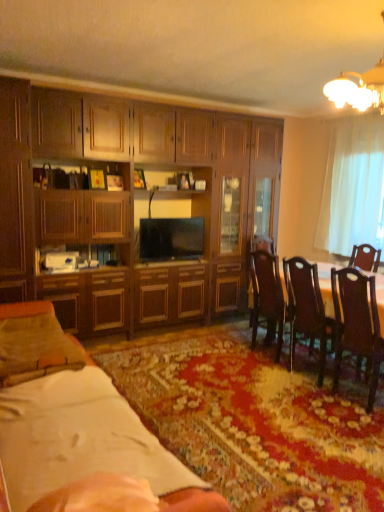
In order to click on white paper at lower left in this screenshot , I will do `click(79, 434)`.

Identify the location of suede-like beige pillow at lower left. (34, 343).

Between point (22, 201) and point (325, 289), which one is positioned in front?

The point (325, 289) is in front.

Image resolution: width=384 pixels, height=512 pixels. I want to click on round table on the right of matte wood cabinet at left, the 2th cabinetry viewed from the right, so click(326, 286).

Which object is positioned more to the right, matte wood cabinet at left, the 2th cabinetry viewed from the right, or brown wooden table at right?

Positioned to the right is brown wooden table at right.

Based on the photo, would you say matte wood cabinet at left, positioned as the first cabinetry in left-to-right order, is outside brown wooden table at right?

Yes, matte wood cabinet at left, positioned as the first cabinetry in left-to-right order, is not within brown wooden table at right.

From a real-world perspective, is white paper at lower left located higher than suede-like beige pillow at lower left?

No, from a real-world perspective, white paper at lower left is not on top of suede-like beige pillow at lower left.

Does point (99, 458) come farther from viewer compared to point (25, 356)?

No, (99, 458) is in front of (25, 356).

Considering the sizes of objects white paper at lower left and suede-like beige pillow at lower left in the image provided, who is shorter, white paper at lower left or suede-like beige pillow at lower left?

With less height is white paper at lower left.

From the image's perspective, between white paper at lower left and suede-like beige pillow at lower left, who is located below?

white paper at lower left.

Considering the relative sizes of brown wooden table at right and dark wood chair at right, which is counted as the 1th chair, starting from the right, in the image provided, is brown wooden table at right wider than dark wood chair at right, which is counted as the 1th chair, starting from the right,?

Indeed, brown wooden table at right has a greater width compared to dark wood chair at right, which is counted as the 1th chair, starting from the right.

Based on their positions, is brown wooden table at right located to the left or right of dark wood chair at right, acting as the 2th chair starting from the left?

From the image, it's evident that brown wooden table at right is to the right of dark wood chair at right, acting as the 2th chair starting from the left.

From the image's perspective, would you say brown wooden table at right is shown under dark wood chair at right, which is counted as the 1th chair, starting from the right?

No, from the image's perspective, brown wooden table at right is not beneath dark wood chair at right, which is counted as the 1th chair, starting from the right.

From the image's perspective, which is above, matte black tv at center or brown wooden table at right?

matte black tv at center.

Is matte black tv at center oriented away from brown wooden table at right?

No.

Which of these two, matte black tv at center or brown wooden table at right, is thinner?

Thinner between the two is matte black tv at center.

How different are the orientations of matte black tv at center and brown wooden table at right in degrees?

The facing directions of matte black tv at center and brown wooden table at right are 86.6 degrees apart.

Is white sheer curtain at right far from white paper at lower left?

Yes, white sheer curtain at right and white paper at lower left are quite far apart.

From a real-world perspective, does white sheer curtain at right stand above white paper at lower left?

Yes.

How much distance is there between white sheer curtain at right and white paper at lower left?

The distance of white sheer curtain at right from white paper at lower left is 3.57 meters.

Measure the distance between brown wooden table at right and white paper at lower left.

They are 6.53 feet apart.

Which object is closer to the camera taking this photo, brown wooden table at right or white paper at lower left?

white paper at lower left is closer to the camera.

Which is in front, point (381, 320) or point (31, 364)?

The point (31, 364) is more forward.

Which object is thinner, brown wooden table at right or white paper at lower left?

Thinner between the two is brown wooden table at right.

From the picture: Is wooden cabinet at center, which is counted as the 1th cabinetry, starting from the right, behind suede-like beige pillow at lower left?

Yes, wooden cabinet at center, which is counted as the 1th cabinetry, starting from the right, is behind suede-like beige pillow at lower left.

Considering the relative sizes of wooden cabinet at center, which is the 2th cabinetry from left to right, and suede-like beige pillow at lower left in the image provided, is wooden cabinet at center, which is the 2th cabinetry from left to right, thinner than suede-like beige pillow at lower left?

Indeed, wooden cabinet at center, which is the 2th cabinetry from left to right, has a lesser width compared to suede-like beige pillow at lower left.

Considering the points (228, 218) and (20, 359), which point is in front, point (228, 218) or point (20, 359)?

The point (20, 359) is more forward.

Is wooden cabinet at center, which is the 2th cabinetry from left to right, positioned with its back to suede-like beige pillow at lower left?

No, wooden cabinet at center, which is the 2th cabinetry from left to right, is not facing the opposite direction of suede-like beige pillow at lower left.

Locate an element on the screen. The width and height of the screenshot is (384, 512). round table below the matte wood cabinet at left, the 2th cabinetry viewed from the right (from a real-world perspective) is located at coordinates (326, 286).

The image size is (384, 512). What are the coordinates of `pillow above the white paper at lower left (from a real-world perspective)` in the screenshot? It's located at (34, 343).

Which object lies nearer to the anchor point white sheer curtain at right, matte black tv at center or dark wood chair at right, acting as the 2th chair starting from the left?

matte black tv at center.

Considering their positions, is brown wooden table at right positioned further to white paper at lower left than dark wood chair at right, the second chair viewed from the back?

Among the two, brown wooden table at right is located further to white paper at lower left.

Estimate the real-world distances between objects in this image. Which object is further from white sheer curtain at right, matte wood cabinet at left, the 2th cabinetry viewed from the right, or brown wooden table at right?

matte wood cabinet at left, the 2th cabinetry viewed from the right, lies further to white sheer curtain at right than the other object.

Estimate the real-world distances between objects in this image. Which object is further from brown wooden table at right, matte wood cabinet at left, positioned as the first cabinetry in left-to-right order, or suede-like beige pillow at lower left?

The object further to brown wooden table at right is matte wood cabinet at left, positioned as the first cabinetry in left-to-right order.

Considering their positions, is wooden cabinet at center, which is the 2th cabinetry from left to right, positioned further to brown wooden table at right than dark brown wood chair at center right, the second chair viewed from the right?

The object further to brown wooden table at right is wooden cabinet at center, which is the 2th cabinetry from left to right.

Based on their spatial positions, is brown wooden table at right or suede-like beige pillow at lower left closer to dark brown wood chair at center right, placed as the 1th chair when sorted from left to right?

Based on the image, brown wooden table at right appears to be nearer to dark brown wood chair at center right, placed as the 1th chair when sorted from left to right.

Based on their spatial positions, is dark wood chair at right, which is counted as the 1th chair, starting from the right, or white paper at lower left closer to suede-like beige pillow at lower left?

The object closer to suede-like beige pillow at lower left is white paper at lower left.

Consider the image. Considering their positions, is white paper at lower left positioned closer to wooden cabinet at center, which is counted as the 1th cabinetry, starting from the right, than white sheer curtain at right?

The object closer to wooden cabinet at center, which is counted as the 1th cabinetry, starting from the right, is white sheer curtain at right.

At what (x,y) coordinates should I click in order to perform the action: click on cabinetry positioned between white paper at lower left and wooden cabinet at center, which is the 2th cabinetry from left to right, from near to far. Please return your answer as a coordinate pair (x, y). This screenshot has height=512, width=384. Looking at the image, I should click on (16, 194).

Identify the location of chair between dark wood chair at right, the 1th chair viewed from the front, and brown wooden table at right, along the z-axis. Image resolution: width=384 pixels, height=512 pixels. (269, 298).

The image size is (384, 512). I want to click on desk located between suede-like beige pillow at lower left and wooden dining table at center in the left-right direction, so tap(79, 434).

Where is `television between matte wood cabinet at left, the 2th cabinetry viewed from the right, and brown wooden table at right from left to right`? television between matte wood cabinet at left, the 2th cabinetry viewed from the right, and brown wooden table at right from left to right is located at coordinates (171, 238).